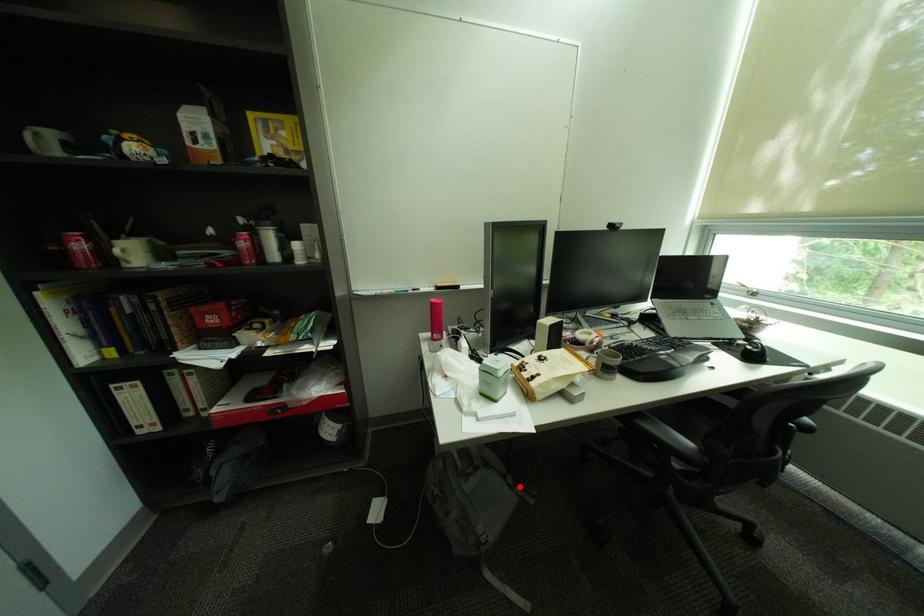
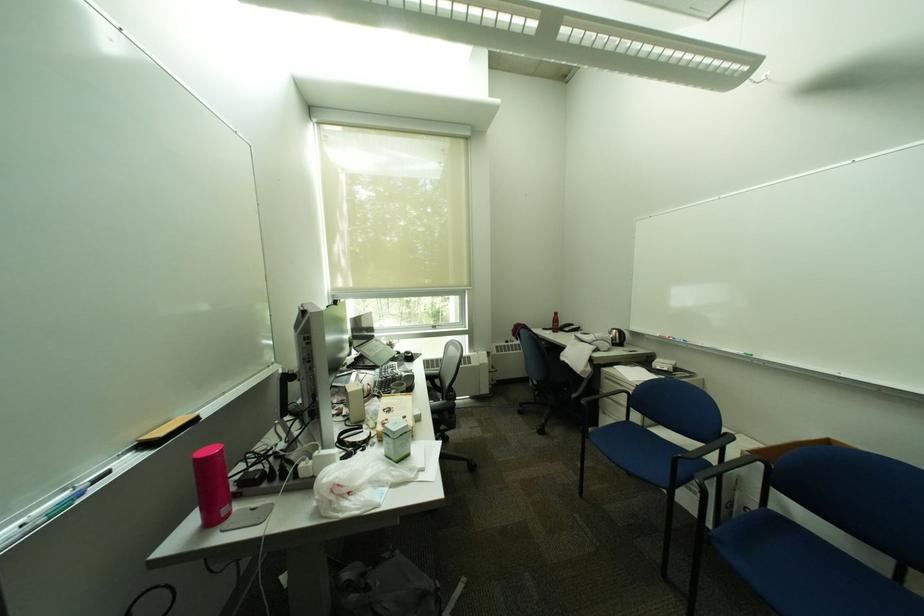
Locate, in the second image, the point that corresponds to the highlighted location in the first image.

(400, 560)